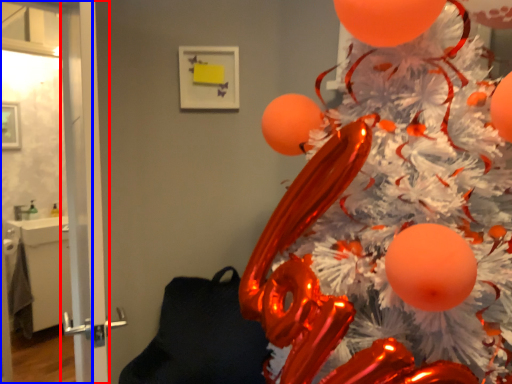
Question: Which of the following is the farthest to the observer, screen door (highlighted by a red box) or screen door (highlighted by a blue box)?

Choices:
 (A) screen door
 (B) screen door

Answer: (B)